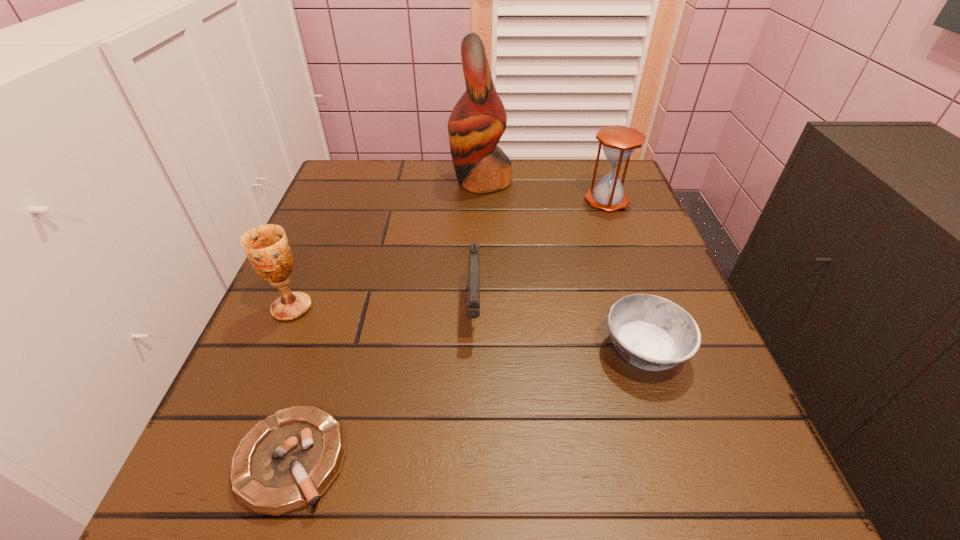
The height and width of the screenshot is (540, 960). In the image, there is a desktop. Find the location of `free space at the far right corner`. free space at the far right corner is located at coordinates pyautogui.click(x=588, y=168).

The width and height of the screenshot is (960, 540). Find the location of `empty location between the left ashtray and the pistol`. empty location between the left ashtray and the pistol is located at coordinates (383, 385).

I want to click on vacant space that is in between the pistol and the fifth tallest object, so click(x=559, y=330).

Identify the location of free spot between the fourth tallest object and the chalice. (383, 309).

Where is `vacant point located between the parrot and the hourglass`? vacant point located between the parrot and the hourglass is located at coordinates [544, 191].

Find the location of a particular element. The height and width of the screenshot is (540, 960). free space between the pistol and the hourglass is located at coordinates pyautogui.click(x=540, y=255).

What are the coordinates of `free space between the tallest object and the chalice` in the screenshot? It's located at pyautogui.click(x=387, y=244).

This screenshot has width=960, height=540. In order to click on vacant area that lies between the nearer ashtray and the pistol in this screenshot , I will do `click(383, 385)`.

Where is `free space between the pistol and the left ashtray`? This screenshot has width=960, height=540. free space between the pistol and the left ashtray is located at coordinates (383, 385).

This screenshot has height=540, width=960. Identify the location of free spot between the taller ashtray and the chalice. (468, 329).